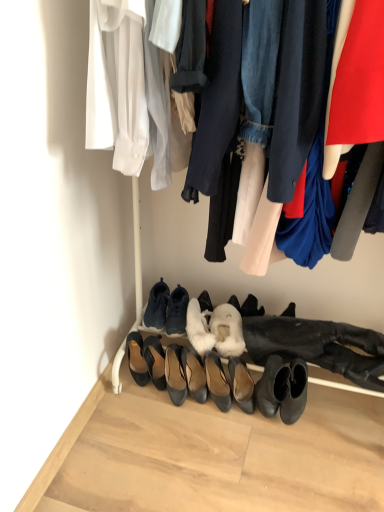
Question: Considering the relative sizes of black leather heels at center, the fifth footwear in the right-to-left sequence, and shiny black heels at center, marked as the 3th footwear in a right-to-left arrangement, in the image provided, is black leather heels at center, the fifth footwear in the right-to-left sequence, smaller than shiny black heels at center, marked as the 3th footwear in a right-to-left arrangement,?

Choices:
 (A) yes
 (B) no

Answer: (B)

Question: Is black leather heels at center, the 4th footwear viewed from the left, thinner than shiny black heels at center, the 6th footwear viewed from the left?

Choices:
 (A) yes
 (B) no

Answer: (B)

Question: From the image's perspective, does black leather heels at center, the fifth footwear in the right-to-left sequence, appear lower than shiny black heels at center, marked as the 3th footwear in a right-to-left arrangement?

Choices:
 (A) yes
 (B) no

Answer: (A)

Question: Is black leather heels at center, the fifth footwear in the right-to-left sequence, positioned behind shiny black heels at center, the 6th footwear viewed from the left?

Choices:
 (A) no
 (B) yes

Answer: (B)

Question: Is black leather heels at center, the 4th footwear viewed from the left, facing away from shiny black heels at center, marked as the 3th footwear in a right-to-left arrangement?

Choices:
 (A) no
 (B) yes

Answer: (A)

Question: Relative to white fur boot at center, which ranks as the second shoe in right-to-left order, is black leather heels at center, the 2th footwear from the left, in front or behind?

Choices:
 (A) behind
 (B) front

Answer: (A)

Question: Considering the positions of black leather heels at center, the seventh footwear when ordered from right to left, and white fur boot at center, which appears as the first shoe when viewed from the left, in the image, is black leather heels at center, the seventh footwear when ordered from right to left, taller or shorter than white fur boot at center, which appears as the first shoe when viewed from the left,?

Choices:
 (A) short
 (B) tall

Answer: (B)

Question: Visually, is black leather heels at center, the 2th footwear from the left, positioned to the left or to the right of white fur boot at center, which ranks as the second shoe in right-to-left order?

Choices:
 (A) left
 (B) right

Answer: (A)

Question: Based on their sizes in the image, would you say black leather heels at center, the 2th footwear from the left, is bigger or smaller than white fur boot at center, which ranks as the second shoe in right-to-left order?

Choices:
 (A) small
 (B) big

Answer: (A)

Question: In terms of height, does black leather heels at center, the 4th footwear viewed from the left, look taller or shorter compared to white fur boot at center, which ranks as the second shoe in right-to-left order?

Choices:
 (A) short
 (B) tall

Answer: (B)

Question: Looking at their shapes, would you say black leather heels at center, the fifth footwear in the right-to-left sequence, is wider or thinner than white fur boot at center, which ranks as the second shoe in right-to-left order?

Choices:
 (A) wide
 (B) thin

Answer: (B)

Question: In the image, is black leather heels at center, the 4th footwear viewed from the left, on the left side or the right side of white fur boot at center, which ranks as the second shoe in right-to-left order?

Choices:
 (A) left
 (B) right

Answer: (A)

Question: Do you think black leather heels at center, the 4th footwear viewed from the left, is within white fur boot at center, which ranks as the second shoe in right-to-left order, or outside of it?

Choices:
 (A) inside
 (B) outside

Answer: (B)

Question: From the image's perspective, relative to matte black sneakers at center, which is the 5th footwear in left-to-right order, is matte black heels at center, which is counted as the seventh footwear, starting from the left, above or below?

Choices:
 (A) above
 (B) below

Answer: (B)

Question: Would you say matte black heels at center, which appears as the 2th footwear when viewed from the right, is inside or outside matte black sneakers at center, which is the 5th footwear in left-to-right order?

Choices:
 (A) inside
 (B) outside

Answer: (B)